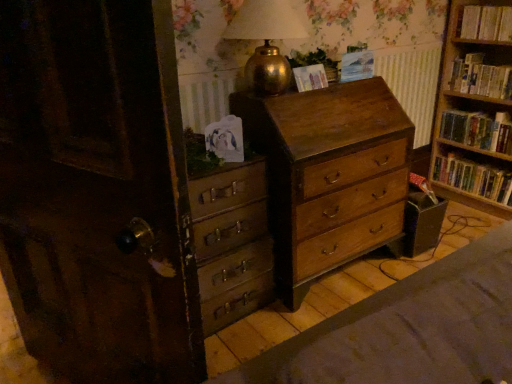
Question: Is wooden chest of drawers at center, the 2th chest of drawers positioned from the left, completely or partially outside of blue paper at upper center, which is counted as the 1th paperback book, starting from the right?

Choices:
 (A) yes
 (B) no

Answer: (A)

Question: Is wooden chest of drawers at center, which is the 1th chest of drawers in right-to-left order, at the left side of blue paper at upper center, which is counted as the 1th paperback book, starting from the right?

Choices:
 (A) no
 (B) yes

Answer: (B)

Question: Can blue paper at upper center, which is counted as the 1th paperback book, starting from the right, be found inside wooden chest of drawers at center, the 2th chest of drawers positioned from the left?

Choices:
 (A) yes
 (B) no

Answer: (B)

Question: Considering the relative positions of wooden chest of drawers at center, the 2th chest of drawers positioned from the left, and blue paper at upper center, which is counted as the 1th paperback book, starting from the right, in the image provided, is wooden chest of drawers at center, the 2th chest of drawers positioned from the left, behind blue paper at upper center, which is counted as the 1th paperback book, starting from the right,?

Choices:
 (A) yes
 (B) no

Answer: (B)

Question: Considering the relative sizes of wooden chest of drawers at center, which is the 1th chest of drawers in right-to-left order, and blue paper at upper center, which is the second paperback book in left-to-right order, in the image provided, is wooden chest of drawers at center, which is the 1th chest of drawers in right-to-left order, smaller than blue paper at upper center, which is the second paperback book in left-to-right order,?

Choices:
 (A) yes
 (B) no

Answer: (B)

Question: Does wooden chest of drawers at center, which is the 1th chest of drawers in right-to-left order, have a greater width compared to blue paper at upper center, which is the second paperback book in left-to-right order?

Choices:
 (A) no
 (B) yes

Answer: (B)

Question: From a real-world perspective, is gold metallic table lamp at upper center on wooden chest of drawers at center, which is the second chest of drawers in right-to-left order?

Choices:
 (A) yes
 (B) no

Answer: (A)

Question: From the image's perspective, is gold metallic table lamp at upper center beneath wooden chest of drawers at center, which is counted as the first chest of drawers, starting from the left?

Choices:
 (A) yes
 (B) no

Answer: (B)

Question: Is gold metallic table lamp at upper center positioned behind wooden chest of drawers at center, which is the second chest of drawers in right-to-left order?

Choices:
 (A) yes
 (B) no

Answer: (B)

Question: Can you confirm if gold metallic table lamp at upper center is smaller than wooden chest of drawers at center, which is counted as the first chest of drawers, starting from the left?

Choices:
 (A) yes
 (B) no

Answer: (A)

Question: From the image's perspective, would you say gold metallic table lamp at upper center is positioned over wooden chest of drawers at center, which is counted as the first chest of drawers, starting from the left?

Choices:
 (A) yes
 (B) no

Answer: (A)

Question: Considering the relative positions of gold metallic table lamp at upper center and wooden chest of drawers at center, which is the second chest of drawers in right-to-left order, in the image provided, is gold metallic table lamp at upper center to the left of wooden chest of drawers at center, which is the second chest of drawers in right-to-left order, from the viewer's perspective?

Choices:
 (A) no
 (B) yes

Answer: (A)

Question: Is hardcover books at right, placed as the 3th book when sorted from bottom to top, completely or partially inside matte paper at upper center, which is counted as the 2th paperback book, starting from the right?

Choices:
 (A) yes
 (B) no

Answer: (B)